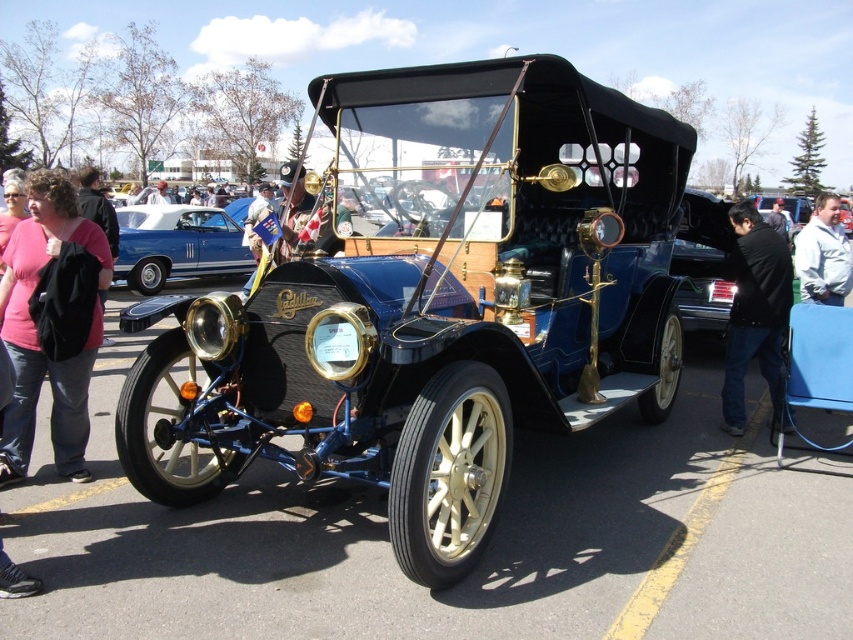
Where is `black leather jacket at lower right`? black leather jacket at lower right is located at coordinates (753, 310).

Image resolution: width=853 pixels, height=640 pixels. What are the coordinates of `black leather jacket at lower right` in the screenshot? It's located at pos(753,310).

Can you confirm if black leather jacket at lower right is positioned below pink fabric shirt at upper left?

No, black leather jacket at lower right is not below pink fabric shirt at upper left.

Is point (788, 288) closer to camera compared to point (42, 246)?

No.

I want to click on black leather jacket at lower right, so click(x=753, y=310).

Who is taller, shiny blue car at center or black leather jacket at center?

black leather jacket at center is taller.

Who is shorter, shiny blue car at center or black leather jacket at center?

With less height is shiny blue car at center.

Is point (151, 289) positioned in front of point (787, 237)?

Yes, point (151, 289) is in front of point (787, 237).

Where is `shiny blue car at center`? This screenshot has height=640, width=853. shiny blue car at center is located at coordinates (177, 244).